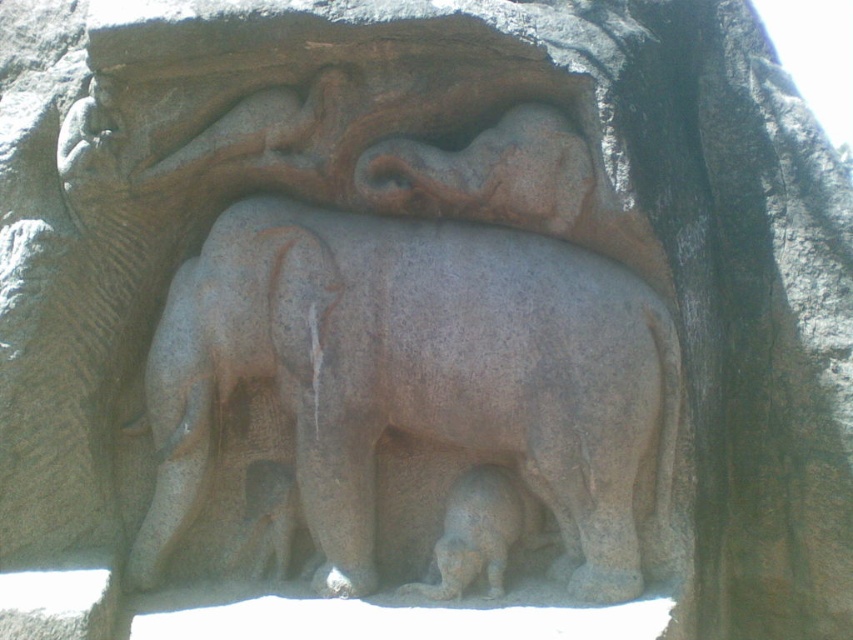
You are an archaeologist examining the stone relief. You need to determine the spatial relationship between the gray stone elephant at center and the gray stone baby elephant at lower center. Which one has a greater width?

The gray stone elephant at center has a greater width than the gray stone baby elephant at lower center.

You are an art conservator examining the carved stone relief. You need to clean both the gray stone elephant at center and the gray stone baby elephant at lower center. Which one should you start with if you want to work from the closest object to the farthest?

You should start with the gray stone elephant at center because it is closer to the viewer than the gray stone baby elephant at lower center.

You are an archaeologist examining the stone relief. You see the gray stone elephant at center and the gray stone baby elephant at lower center. Which one is located more to the left?

The gray stone elephant at center is positioned more to the left than the gray stone baby elephant at lower center.